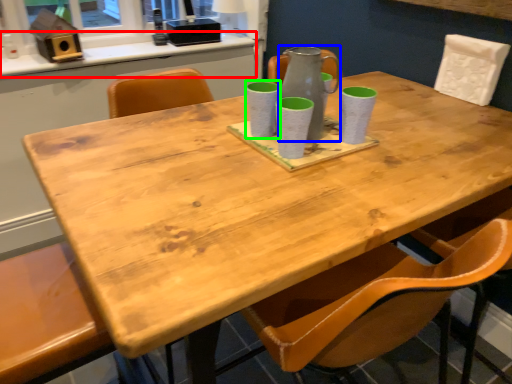
Question: Which is farther away from counter top (highlighted by a red box)? glass vase (highlighted by a blue box) or mug (highlighted by a green box)?

Choices:
 (A) glass vase
 (B) mug

Answer: (A)